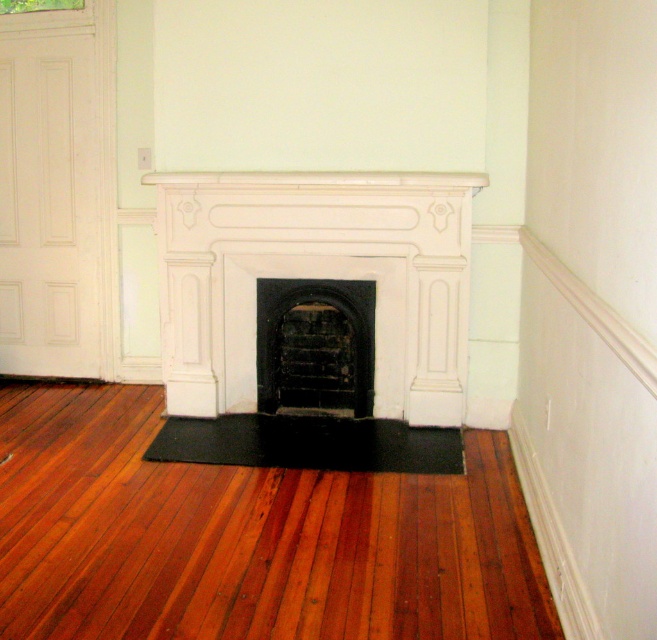
Between shiny brown wood flooring at center and black rubber mat at center, which one is positioned lower?

shiny brown wood flooring at center

Is shiny brown wood flooring at center below black rubber mat at center?

Result: Correct, shiny brown wood flooring at center is located below black rubber mat at center.

Locate an element on the screen. The image size is (657, 640). shiny brown wood flooring at center is located at coordinates (246, 536).

Locate an element on the screen. The height and width of the screenshot is (640, 657). shiny brown wood flooring at center is located at coordinates (246, 536).

Looking at this image, can you confirm if shiny brown wood flooring at center is shorter than white stone fireplace at center?

Yes, shiny brown wood flooring at center is shorter than white stone fireplace at center.

Can you confirm if shiny brown wood flooring at center is taller than white stone fireplace at center?

No, shiny brown wood flooring at center is not taller than white stone fireplace at center.

The height and width of the screenshot is (640, 657). Identify the location of shiny brown wood flooring at center. (246, 536).

Where is `shiny brown wood flooring at center`? This screenshot has height=640, width=657. shiny brown wood flooring at center is located at coordinates (246, 536).

Which of these two, black matte fireplace at center or black rubber mat at center, stands taller?

black matte fireplace at center is taller.

Can you confirm if black matte fireplace at center is positioned to the right of black rubber mat at center?

Yes, black matte fireplace at center is to the right of black rubber mat at center.

Where is `black matte fireplace at center`? black matte fireplace at center is located at coordinates (315, 346).